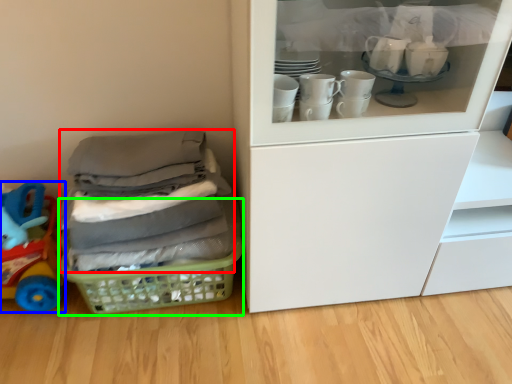
Question: Which object is the farthest from clothing (highlighted by a red box)? Choose among these: toy (highlighted by a blue box) or basket (highlighted by a green box).

Choices:
 (A) toy
 (B) basket

Answer: (A)